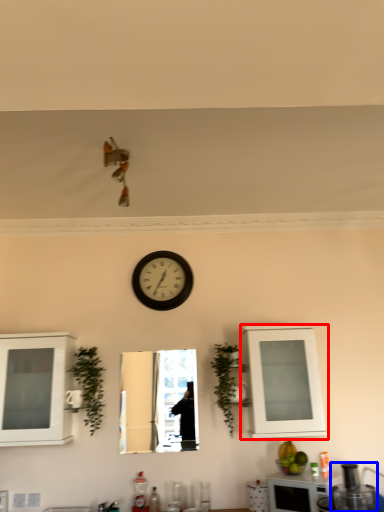
Question: Which object is further to the camera taking this photo, cabinetry (highlighted by a red box) or appliance (highlighted by a blue box)?

Choices:
 (A) cabinetry
 (B) appliance

Answer: (A)